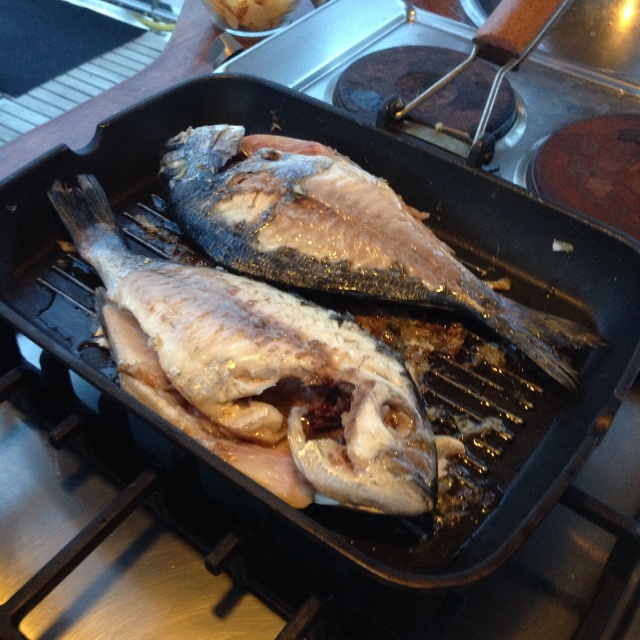
You are standing in front of the stovetop with the grill pan. There are two points marked on the pan at coordinates point (320, 452) and point (164, 145). If you want to reach the point that is closer to you, which coordinate should you aim for?

Point (320, 452) is in front of point (164, 145), so you should aim for point (320, 452) as it is closer to you.

You are a chef preparing two fish in a grill pan. You need to know which fish is wider to adjust cooking time. The shiny silver fish at center and the glistening silver fish at center are both in the pan. Which one is wider?

The glistening silver fish at center is wider than the shiny silver fish at center.

Based on the photo, you are a chef trying to flip both the shiny silver fish at center and the glistening silver fish at center using a spatula. The spatula you have can only reach 6 inches. Can you flip both fish with one spatula without moving the pan?

The distance between the shiny silver fish at center and glistening silver fish at center is 6.55 inches, which is greater than the spatula length of 6 inches. Therefore, you cannot flip both fish with one spatula without moving the pan.